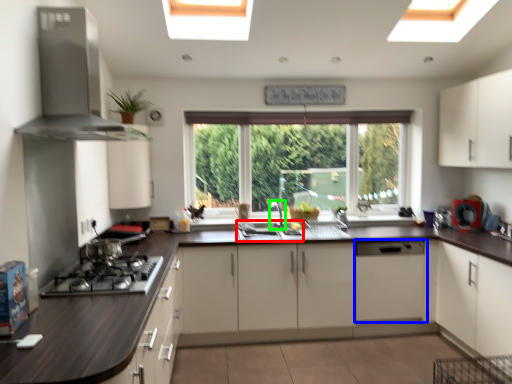
Question: Which object is positioned closest to sink (highlighted by a red box)? Select from cabinetry (highlighted by a blue box) and faucet (highlighted by a green box).

Choices:
 (A) cabinetry
 (B) faucet

Answer: (B)